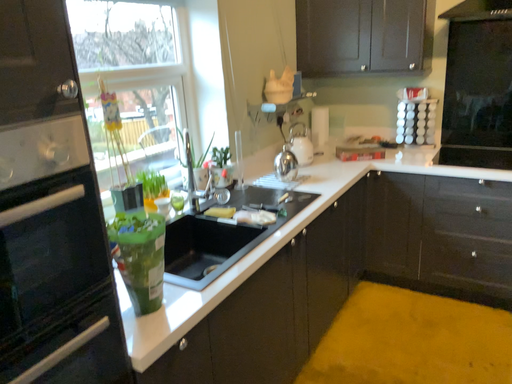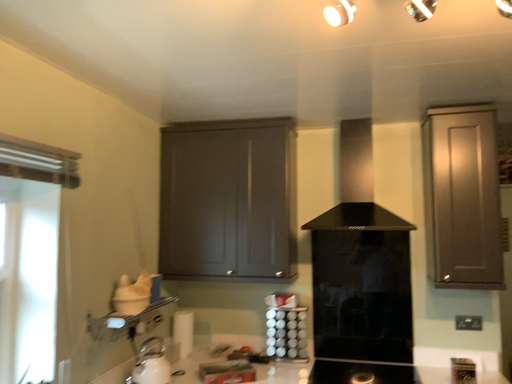
Question: Which way did the camera rotate in the video?

Choices:
 (A) rotated left
 (B) rotated right

Answer: (B)